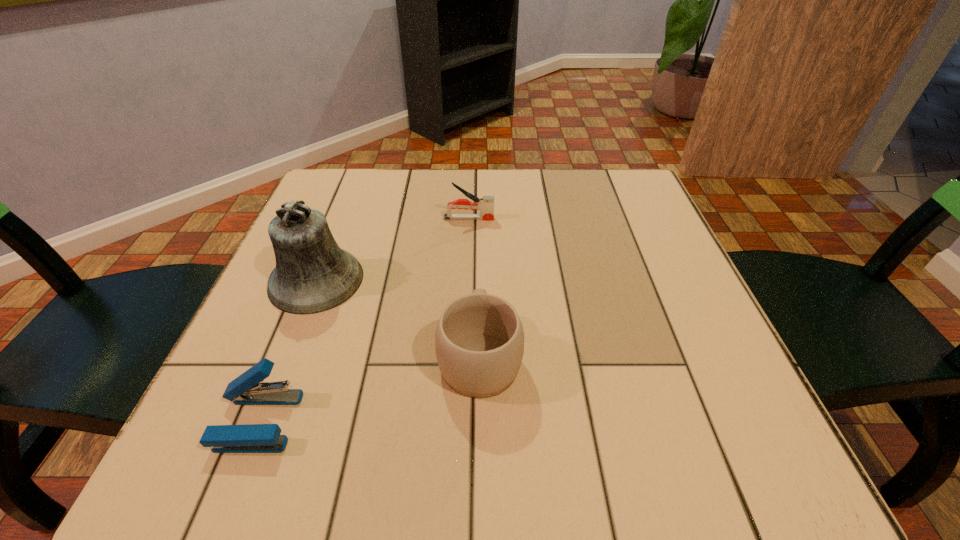
This screenshot has height=540, width=960. Find the location of `free spot between the farther stapler and the mug`. free spot between the farther stapler and the mug is located at coordinates (474, 287).

Find the location of a particular element. The height and width of the screenshot is (540, 960). unoccupied area between the second farthest object and the left stapler is located at coordinates (287, 350).

Image resolution: width=960 pixels, height=540 pixels. I want to click on unoccupied position between the tallest object and the right stapler, so click(x=393, y=249).

I want to click on object that is the second closest to the right stapler, so click(x=479, y=340).

Find the location of a particular element. This screenshot has width=960, height=540. the closest object to the mug is located at coordinates (313, 274).

Find the location of a particular element. blank area in the image that satisfies the following two spatial constraints: 1. on the handle side of the farthest object; 2. on the front side of the tallest object is located at coordinates (467, 280).

You are a GUI agent. You are given a task and a screenshot of the screen. Output one action in this format:
    pyautogui.click(x=<x>, y=<y>)
    Task: Click on the vacant space that satisfies the following two spatial constraints: 1. on the back side of the left stapler; 2. on the left side of the tallest object
    This screenshot has height=540, width=960.
    Given the screenshot: What is the action you would take?
    pyautogui.click(x=314, y=280)

Where is `blank area in the image that satisfies the following two spatial constraints: 1. on the back side of the left stapler; 2. on the right side of the tallest object`? blank area in the image that satisfies the following two spatial constraints: 1. on the back side of the left stapler; 2. on the right side of the tallest object is located at coordinates (314, 280).

You are a GUI agent. You are given a task and a screenshot of the screen. Output one action in this format:
    pyautogui.click(x=<x>, y=<y>)
    Task: Click on the vacant region that satisfies the following two spatial constraints: 1. on the handle side of the right stapler; 2. on the side of the mug with the handle
    
    Given the screenshot: What is the action you would take?
    465,355

This screenshot has height=540, width=960. I want to click on vacant space that satisfies the following two spatial constraints: 1. on the side of the mug with the handle; 2. on the handle side of the farther stapler, so click(x=480, y=219).